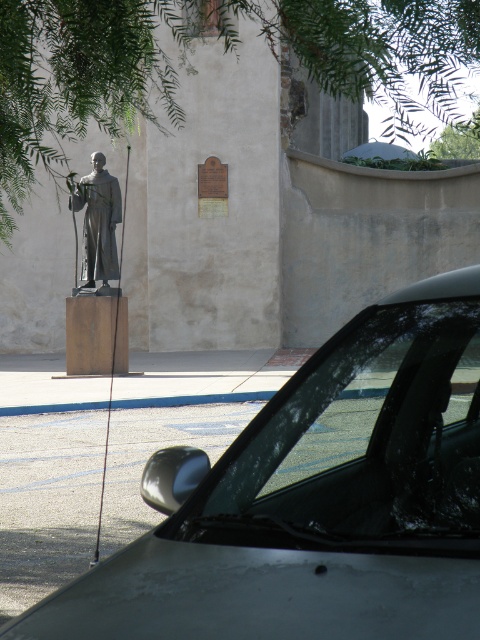
Who is shorter, transparent glass car window at center or matte gray statue at left?

With less height is transparent glass car window at center.

Can you confirm if transparent glass car window at center is smaller than matte gray statue at left?

Indeed, transparent glass car window at center has a smaller size compared to matte gray statue at left.

This screenshot has height=640, width=480. Describe the element at coordinates (360, 444) in the screenshot. I see `transparent glass car window at center` at that location.

I want to click on transparent glass car window at center, so coord(360,444).

Is silver metallic car at lower left taller than matte gray statue at left?

No, silver metallic car at lower left is not taller than matte gray statue at left.

Is point (475, 308) behind point (98, 228)?

No.

In order to click on silver metallic car at lower left in this screenshot , I will do `click(313, 502)`.

Does silver metallic car at lower left appear under transparent glass car window at center?

Correct, silver metallic car at lower left is located below transparent glass car window at center.

Can you confirm if silver metallic car at lower left is positioned to the left of transparent glass car window at center?

Yes, silver metallic car at lower left is to the left of transparent glass car window at center.

Where is `silver metallic car at lower left`? The height and width of the screenshot is (640, 480). silver metallic car at lower left is located at coordinates (313, 502).

At what (x,y) coordinates should I click in order to perform the action: click on silver metallic car at lower left. Please return your answer as a coordinate pair (x, y). The image size is (480, 640). Looking at the image, I should click on (313, 502).